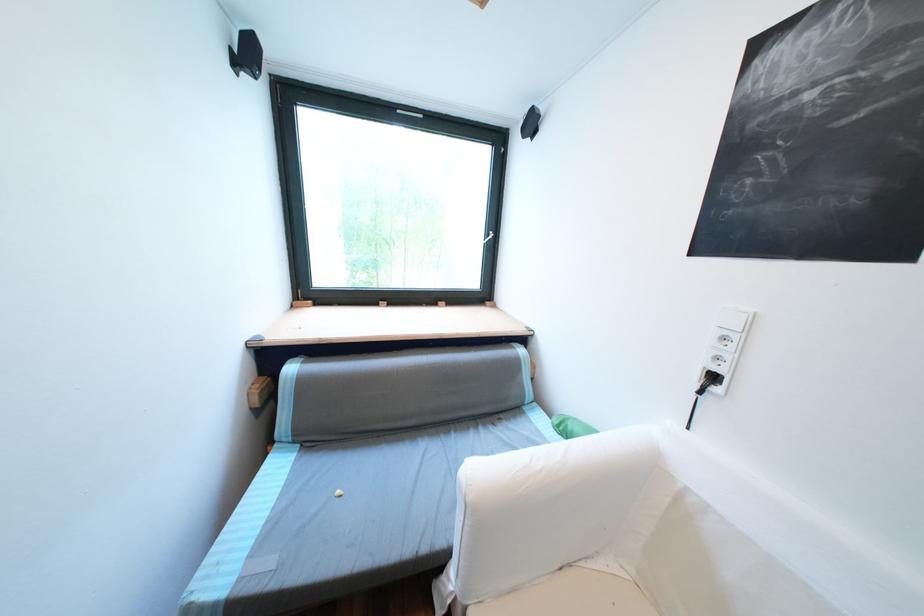
This screenshot has height=616, width=924. What do you see at coordinates (725, 345) in the screenshot?
I see `the white wall switch` at bounding box center [725, 345].